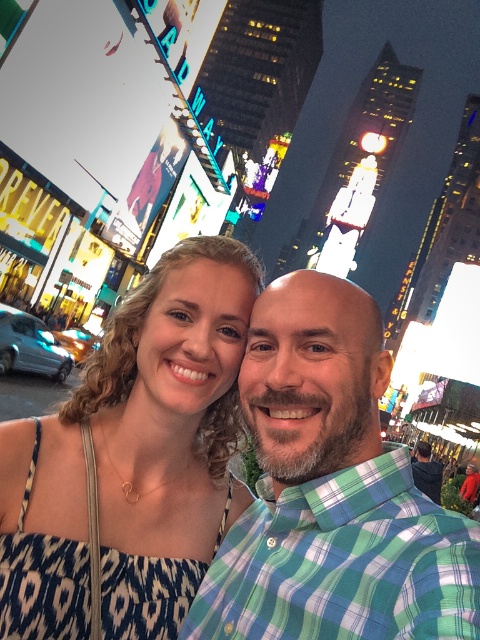
You are a photographer trying to capture the perfect shot of the blue printed dress at center and the green plaid shirt at center. Since you want to include both subjects in the frame, which direction should you position your camera relative to the subjects?

The blue printed dress at center is to the left of the green plaid shirt at center, so you should position your camera to the right side of the subjects to ensure both the blue printed dress at center and the green plaid shirt at center are captured in the frame.

Consider the image. You are a photographer standing at the edge of Times Square, New York City, and you want to take a photo of the blue printed dress at center and the green plaid shirt at center. If your camera has a maximum focus range of 2.5 meters, will you be able to capture both subjects clearly in the same frame?

The blue printed dress at center is 3.01 meters from the green plaid shirt at center, which exceeds the camera maximum focus range of 2.5 meters. Therefore, you cannot capture both subjects clearly in the same frame.